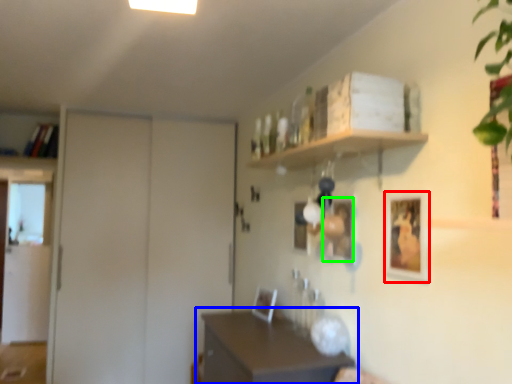
Question: Which is farther away from picture frame (highlighted by a red box)? table (highlighted by a blue box) or picture frame (highlighted by a green box)?

Choices:
 (A) table
 (B) picture frame

Answer: (A)